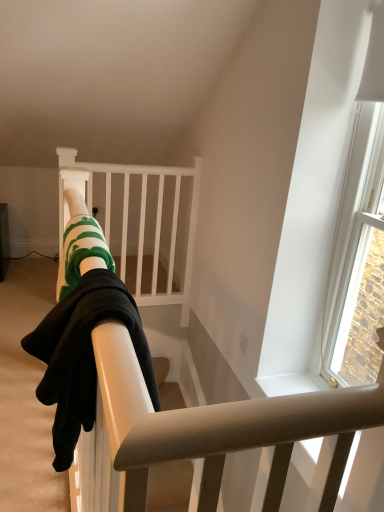
Question: From a real-world perspective, is green striped socks at center physically located above or below white matte wooden crib at upper center?

Choices:
 (A) below
 (B) above

Answer: (B)

Question: In the image, is green striped socks at center on the left side or the right side of white matte wooden crib at upper center?

Choices:
 (A) right
 (B) left

Answer: (A)

Question: Relative to white matte wooden crib at upper center, is green striped socks at center in front or behind?

Choices:
 (A) front
 (B) behind

Answer: (A)

Question: Is white matte wooden crib at upper center spatially inside green striped socks at center, or outside of it?

Choices:
 (A) inside
 (B) outside

Answer: (B)

Question: Is white matte wooden crib at upper center taller or shorter than green striped socks at center?

Choices:
 (A) short
 (B) tall

Answer: (B)

Question: Considering their positions, is white matte wooden crib at upper center located in front of or behind green striped socks at center?

Choices:
 (A) front
 (B) behind

Answer: (B)

Question: Is point (129, 165) positioned closer to the camera than point (97, 266)?

Choices:
 (A) farther
 (B) closer

Answer: (A)